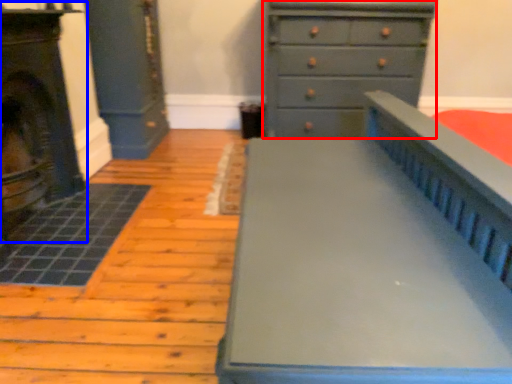
Question: Among these objects, which one is nearest to the camera, chest of drawers (highlighted by a red box) or fireplace (highlighted by a blue box)?

Choices:
 (A) chest of drawers
 (B) fireplace

Answer: (B)